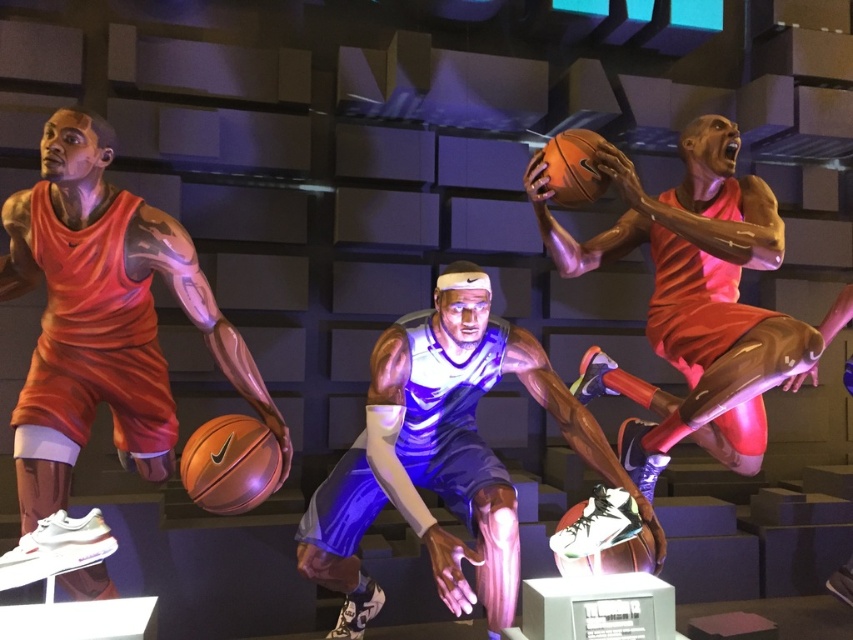
Is matte orange jersey at left above shiny orange basketball at center?

Indeed, matte orange jersey at left is positioned over shiny orange basketball at center.

Can you confirm if matte orange jersey at left is thinner than shiny orange basketball at center?

No, matte orange jersey at left is not thinner than shiny orange basketball at center.

Does point (36, 268) come behind point (563, 557)?

That is True.

You are a GUI agent. You are given a task and a screenshot of the screen. Output one action in this format:
    pyautogui.click(x=<x>, y=<y>)
    Task: Click on the matte orange jersey at left
    
    Given the screenshot: What is the action you would take?
    pyautogui.click(x=103, y=317)

Who is higher up, shiny blue jersey at center or shiny orange basketball at center?

Positioned higher is shiny orange basketball at center.

The image size is (853, 640). Find the location of `shiny blue jersey at center`. shiny blue jersey at center is located at coordinates (444, 456).

Who is taller, shiny blue jersey at center or shiny orange basketball player at upper right?

Standing taller between the two is shiny blue jersey at center.

Can you confirm if shiny blue jersey at center is positioned below shiny orange basketball player at upper right?

Indeed, shiny blue jersey at center is positioned under shiny orange basketball player at upper right.

Does point (466, 404) lie in front of point (676, 228)?

No, (466, 404) is further to viewer.

What are the coordinates of `shiny blue jersey at center` in the screenshot? It's located at (444, 456).